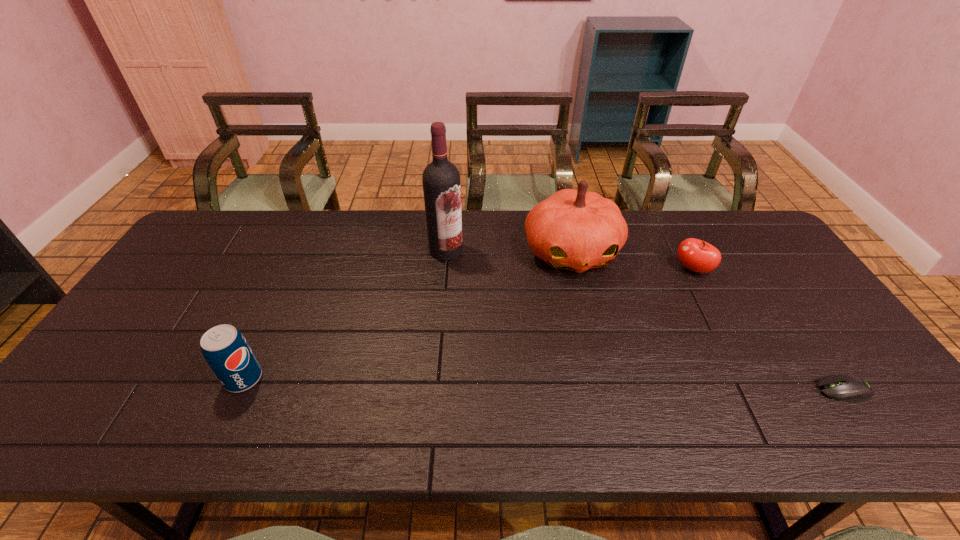
You are a GUI agent. You are given a task and a screenshot of the screen. Output one action in this format:
    pyautogui.click(x=<x>, y=<y>)
    Task: Click on the vacant space on the desktop that is between the third shortest object and the rightmost object and is positioned on the label of the wine bottle
    The width and height of the screenshot is (960, 540).
    Given the screenshot: What is the action you would take?
    pyautogui.click(x=538, y=384)

What are the coordinates of `vacant spot on the desktop that is between the leftmost object and the computer mouse and is positioned on the front-facing side of the fourth shortest object` in the screenshot? It's located at (613, 386).

Locate an element on the screen. vacant space on the desktop that is between the leftmost object and the computer mouse and is positioned on the stem of the fourth tallest object is located at coordinates coord(552,385).